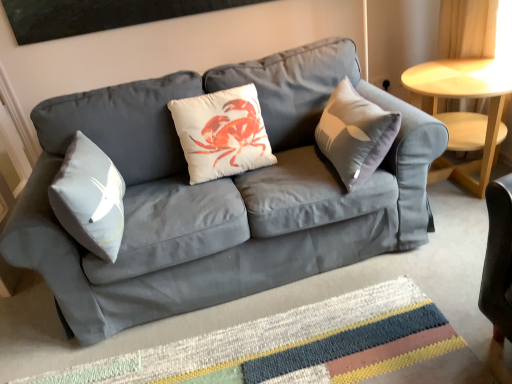
Locate an element on the screen. The image size is (512, 384). multicolored woven mat at center is located at coordinates (285, 343).

Describe the element at coordinates (464, 112) in the screenshot. I see `light wood/finished table at right` at that location.

Identify the location of white matte cushion at center. (222, 133).

Is light wood/finished table at right surrounded by multicolored woven mat at center?

No, light wood/finished table at right is not inside multicolored woven mat at center.

Can you tell me how much multicolored woven mat at center and light wood/finished table at right differ in facing direction?

The angle between the facing direction of multicolored woven mat at center and the facing direction of light wood/finished table at right is 180 degrees.

Between point (400, 322) and point (484, 94), which one is positioned behind?

Point (484, 94)

Is multicolored woven mat at center facing away from light wood/finished table at right?

multicolored woven mat at center does not have its back to light wood/finished table at right.

Is light wood/finished table at right not within matte gray couch at center?

Yes.

In terms of width, does light wood/finished table at right look wider or thinner when compared to matte gray couch at center?

Clearly, light wood/finished table at right has less width compared to matte gray couch at center.

Is light wood/finished table at right far away from matte gray couch at center?

That's not correct — light wood/finished table at right is a little close to matte gray couch at center.

In order to click on pillow above the light wood/finished table at right (from a real-world perspective) in this screenshot , I will do `click(222, 133)`.

Considering the relative sizes of white matte cushion at center and light wood/finished table at right in the image provided, is white matte cushion at center bigger than light wood/finished table at right?

No, white matte cushion at center is not bigger than light wood/finished table at right.

Is white matte cushion at center to the left or to the right of light wood/finished table at right in the image?

In the image, white matte cushion at center appears on the left side of light wood/finished table at right.

Looking at this image, is white matte cushion at center not close to light wood/finished table at right?

white matte cushion at center is far away from light wood/finished table at right.

Which is behind, multicolored woven mat at center or matte gray couch at center?

matte gray couch at center is more distant.

Considering the relative sizes of multicolored woven mat at center and matte gray couch at center in the image provided, is multicolored woven mat at center taller than matte gray couch at center?

No.

How much distance is there between multicolored woven mat at center and matte gray couch at center?

multicolored woven mat at center is 49.14 centimeters from matte gray couch at center.

From the image's perspective, is multicolored woven mat at center positioned above or below matte gray couch at center?

From the image's perspective, multicolored woven mat at center appears below matte gray couch at center.

Is matte gray couch at center not near multicolored woven mat at center?

They are positioned close to each other.

Considering the relative sizes of matte gray couch at center and multicolored woven mat at center in the image provided, is matte gray couch at center taller than multicolored woven mat at center?

Yes, matte gray couch at center is taller than multicolored woven mat at center.

Is matte gray couch at center facing towards multicolored woven mat at center?

Yes, matte gray couch at center is facing multicolored woven mat at center.

Is matte gray couch at center inside the boundaries of multicolored woven mat at center, or outside?

matte gray couch at center lies outside multicolored woven mat at center.

Would you say matte gray couch at center is inside or outside light wood/finished table at right?

matte gray couch at center is not enclosed by light wood/finished table at right.

The height and width of the screenshot is (384, 512). Find the location of `table above the matte gray couch at center (from the image's perspective)`. table above the matte gray couch at center (from the image's perspective) is located at coordinates (464, 112).

Is point (59, 293) less distant than point (422, 92)?

Yes, point (59, 293) is closer to viewer.

Relative to light wood/finished table at right, is matte gray couch at center in front or behind?

matte gray couch at center is in front of light wood/finished table at right.

Which is more to the right, matte gray couch at center or white matte cushion at center?

matte gray couch at center.

From the image's perspective, is matte gray couch at center positioned above or below white matte cushion at center?

matte gray couch at center is situated lower than white matte cushion at center in the image.

Which point is more distant from viewer, [168,289] or [234,170]?

Positioned behind is point [234,170].

Does matte gray couch at center turn towards white matte cushion at center?

Yes, matte gray couch at center is turned towards white matte cushion at center.

You are a GUI agent. You are given a task and a screenshot of the screen. Output one action in this format:
    pyautogui.click(x=<x>, y=<y>)
    Task: Click on the mat that appears in front of the light wood/finished table at right
    The width and height of the screenshot is (512, 384).
    Given the screenshot: What is the action you would take?
    pyautogui.click(x=285, y=343)

Find the location of a particular element. The width and height of the screenshot is (512, 384). table behind the matte gray couch at center is located at coordinates (464, 112).

From the image, which object appears to be farther from matte gray couch at center, light wood/finished table at right or white matte cushion at center?

Based on the image, light wood/finished table at right appears to be further to matte gray couch at center.

Considering their positions, is multicolored woven mat at center positioned closer to light wood/finished table at right than matte gray couch at center?

Among the two, matte gray couch at center is located nearer to light wood/finished table at right.

When comparing their distances from white matte cushion at center, does light wood/finished table at right or matte gray couch at center seem closer?

matte gray couch at center.

From the image, which object appears to be nearer to matte gray couch at center, white matte cushion at center or light wood/finished table at right?

white matte cushion at center lies closer to matte gray couch at center than the other object.

From the picture: Which object lies nearer to the anchor point white matte cushion at center, matte gray couch at center or multicolored woven mat at center?

matte gray couch at center is positioned closer to the anchor white matte cushion at center.

Based on their spatial positions, is multicolored woven mat at center or light wood/finished table at right closer to white matte cushion at center?

Result: multicolored woven mat at center.

When comparing their distances from light wood/finished table at right, does matte gray couch at center or white matte cushion at center seem further?

white matte cushion at center.

When comparing their distances from light wood/finished table at right, does matte gray couch at center or multicolored woven mat at center seem further?

multicolored woven mat at center lies further to light wood/finished table at right than the other object.

This screenshot has width=512, height=384. I want to click on mat between white matte cushion at center and light wood/finished table at right in the horizontal direction, so click(285, 343).

You are a GUI agent. You are given a task and a screenshot of the screen. Output one action in this format:
    pyautogui.click(x=<x>, y=<y>)
    Task: Click on the studio couch between white matte cushion at center and light wood/finished table at right in the horizontal direction
    The image size is (512, 384).
    Given the screenshot: What is the action you would take?
    pyautogui.click(x=221, y=194)

Where is `studio couch between white matte cushion at center and multicolored woven mat at center from top to bottom`? This screenshot has height=384, width=512. studio couch between white matte cushion at center and multicolored woven mat at center from top to bottom is located at coordinates (221, 194).

The width and height of the screenshot is (512, 384). Find the location of `mat located between matte gray couch at center and light wood/finished table at right in the left-right direction`. mat located between matte gray couch at center and light wood/finished table at right in the left-right direction is located at coordinates (285, 343).